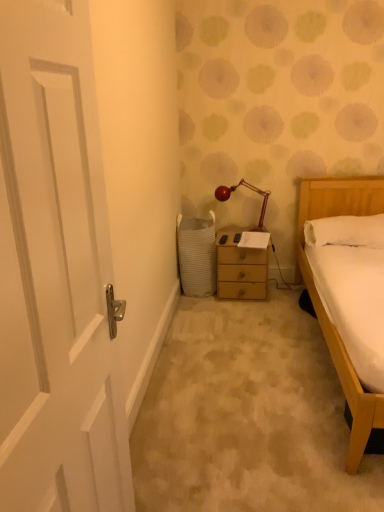
The image size is (384, 512). I want to click on free space in front of white woven laundry basket at lower center, so click(x=205, y=311).